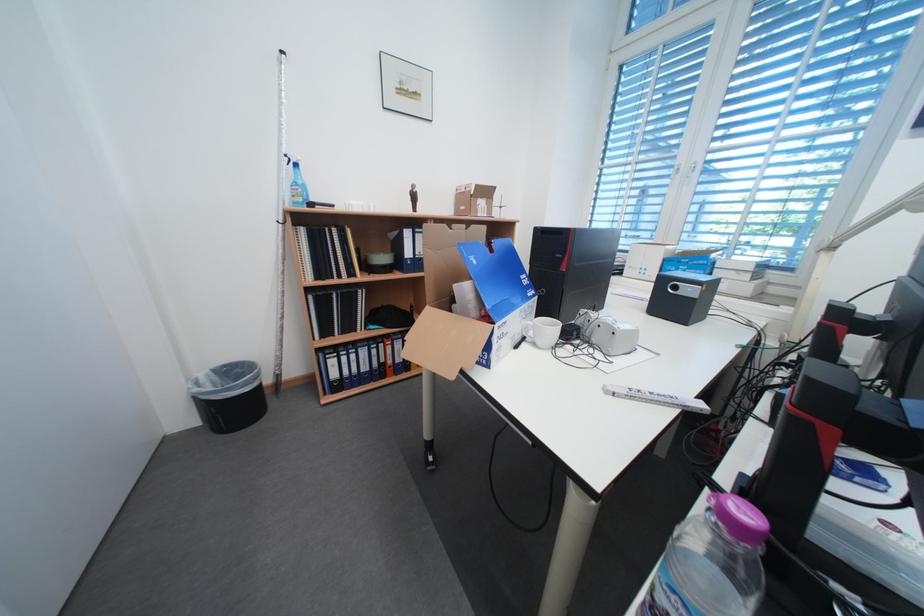
Find where to lift the white folding ruler. Please return your answer as a coordinate pair (x, y).

(657, 398)